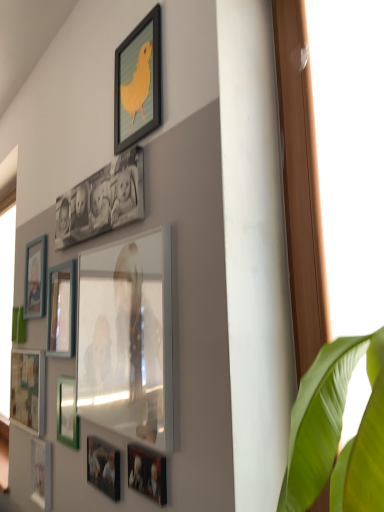
Question: From a real-world perspective, does wooden photo frame at left, the eighth picture frame positioned from the bottom, sit lower than matte black picture frame at upper center, the first picture frame viewed from the top?

Choices:
 (A) yes
 (B) no

Answer: (A)

Question: Considering the relative sizes of wooden photo frame at left, the eighth picture frame positioned from the bottom, and matte black picture frame at upper center, which is the eleventh picture frame from bottom to top, in the image provided, is wooden photo frame at left, the eighth picture frame positioned from the bottom, taller than matte black picture frame at upper center, which is the eleventh picture frame from bottom to top,?

Choices:
 (A) no
 (B) yes

Answer: (A)

Question: Can you confirm if wooden photo frame at left, the eighth picture frame positioned from the bottom, is wider than matte black picture frame at upper center, which is the eleventh picture frame from bottom to top?

Choices:
 (A) no
 (B) yes

Answer: (B)

Question: Considering the relative sizes of wooden photo frame at left, the eighth picture frame positioned from the bottom, and matte black picture frame at upper center, which is the eleventh picture frame from bottom to top, in the image provided, is wooden photo frame at left, the eighth picture frame positioned from the bottom, smaller than matte black picture frame at upper center, which is the eleventh picture frame from bottom to top,?

Choices:
 (A) no
 (B) yes

Answer: (A)

Question: From the image's perspective, is wooden photo frame at left, positioned as the fourth picture frame in top-to-bottom order, on matte black picture frame at upper center, which is the eleventh picture frame from bottom to top?

Choices:
 (A) no
 (B) yes

Answer: (A)

Question: In the image, is matte black picture frame at lower center, which is the 2th picture frame from bottom to top, positioned in front of or behind green matte picture frame at lower left, positioned as the fourth picture frame in bottom-to-top order?

Choices:
 (A) behind
 (B) front

Answer: (B)

Question: In terms of height, does matte black picture frame at lower center, the tenth picture frame in the top-to-bottom sequence, look taller or shorter compared to green matte picture frame at lower left, positioned as the fourth picture frame in bottom-to-top order?

Choices:
 (A) short
 (B) tall

Answer: (A)

Question: From the image's perspective, is matte black picture frame at lower center, which is the 2th picture frame from bottom to top, positioned above or below green matte picture frame at lower left, positioned as the fourth picture frame in bottom-to-top order?

Choices:
 (A) above
 (B) below

Answer: (B)

Question: In the image, is matte black picture frame at lower center, which is the 2th picture frame from bottom to top, on the left side or the right side of green matte picture frame at lower left, positioned as the fourth picture frame in bottom-to-top order?

Choices:
 (A) right
 (B) left

Answer: (A)

Question: Is matte wooden picture frame at left, which is the ninth picture frame from bottom to top, in front of or behind matte black photo frame at upper center, which is the tenth picture frame from bottom to top, in the image?

Choices:
 (A) behind
 (B) front

Answer: (A)

Question: Considering the positions of matte wooden picture frame at left, which is the ninth picture frame from bottom to top, and matte black photo frame at upper center, which is the tenth picture frame from bottom to top, in the image, is matte wooden picture frame at left, which is the ninth picture frame from bottom to top, bigger or smaller than matte black photo frame at upper center, which is the tenth picture frame from bottom to top,?

Choices:
 (A) small
 (B) big

Answer: (A)

Question: From the image's perspective, relative to matte black photo frame at upper center, the second picture frame viewed from the top, is matte wooden picture frame at left, which appears as the third picture frame when viewed from the top, above or below?

Choices:
 (A) above
 (B) below

Answer: (B)

Question: Would you say matte wooden picture frame at left, which is the ninth picture frame from bottom to top, is inside or outside matte black photo frame at upper center, the second picture frame viewed from the top?

Choices:
 (A) outside
 (B) inside

Answer: (A)

Question: Is matte black picture frame at lower center, which is the 2th picture frame from bottom to top, bigger or smaller than matte white picture frame at lower left, acting as the 9th picture frame starting from the top?

Choices:
 (A) big
 (B) small

Answer: (B)

Question: Visually, is matte black picture frame at lower center, the tenth picture frame in the top-to-bottom sequence, positioned to the left or to the right of matte white picture frame at lower left, acting as the 9th picture frame starting from the top?

Choices:
 (A) right
 (B) left

Answer: (A)